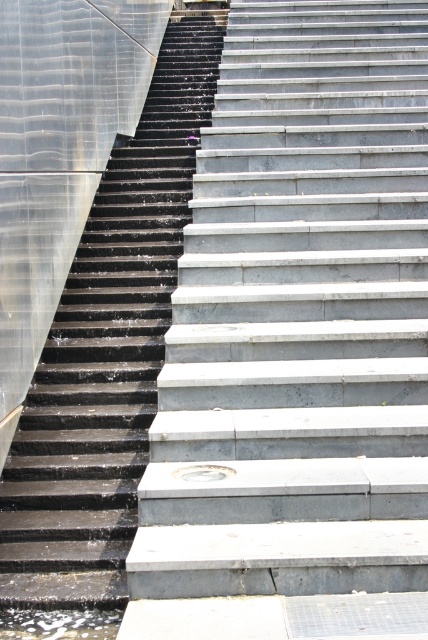
You are a delivery person carrying a large package and need to choose between the smooth concrete stairs at center and the black rubber stairs at left. Which staircase is wider to accommodate your bulky item?

The smooth concrete stairs at center are wider than the black rubber stairs at left, so they can accommodate your bulky item better.

You are standing at the origin point of the scene. Which direction should you move to reach the smooth concrete stairs at center?

The smooth concrete stairs at center are located at coordinates point (x=299, y=317), so you should move towards the center of the scene to reach them.

You are a delivery person carrying a heavy box and need to climb the stairs. Which set of stairs, the smooth concrete stairs at center or the black rubber stairs at left, should you choose to avoid slipping due to the wet conditions?

The smooth concrete stairs at center is taller than the black rubber stairs at left. However, since the black rubber stairs at left are made of rubber, they likely provide better traction in wet conditions, so you should choose the black rubber stairs at left to avoid slipping.